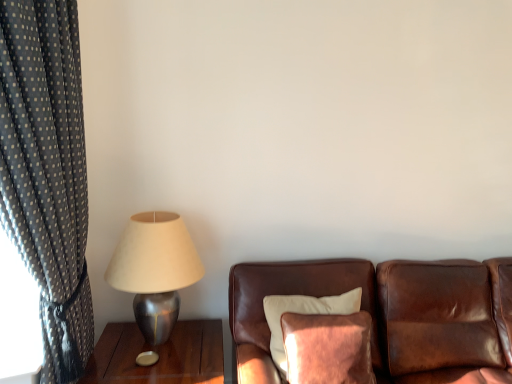
Question: From the image's perspective, is brown leather couch at center beneath dark gray polka dot fabric at left?

Choices:
 (A) no
 (B) yes

Answer: (B)

Question: Is brown leather couch at center completely or partially outside of dark gray polka dot fabric at left?

Choices:
 (A) no
 (B) yes

Answer: (B)

Question: Considering the relative positions of brown leather couch at center and dark gray polka dot fabric at left in the image provided, is brown leather couch at center behind dark gray polka dot fabric at left?

Choices:
 (A) no
 (B) yes

Answer: (B)

Question: Is dark gray polka dot fabric at left completely or partially inside brown leather couch at center?

Choices:
 (A) yes
 (B) no

Answer: (B)

Question: Is brown leather couch at center bigger than dark gray polka dot fabric at left?

Choices:
 (A) no
 (B) yes

Answer: (B)

Question: Could you tell me if brown leather couch at center is turned towards dark gray polka dot fabric at left?

Choices:
 (A) no
 (B) yes

Answer: (A)

Question: Can you confirm if velvet brown pillow at center is wider than metallic silver table at left?

Choices:
 (A) yes
 (B) no

Answer: (B)

Question: Is velvet brown pillow at center directly adjacent to metallic silver table at left?

Choices:
 (A) yes
 (B) no

Answer: (B)

Question: Is velvet brown pillow at center behind metallic silver table at left?

Choices:
 (A) no
 (B) yes

Answer: (A)

Question: From the image's perspective, is velvet brown pillow at center on metallic silver table at left?

Choices:
 (A) no
 (B) yes

Answer: (B)

Question: Does velvet brown pillow at center have a greater height compared to metallic silver table at left?

Choices:
 (A) yes
 (B) no

Answer: (A)

Question: Is velvet brown pillow at center at the left side of metallic silver table at left?

Choices:
 (A) yes
 (B) no

Answer: (B)

Question: Does metallic silver table at left have a larger size compared to velvet brown pillow at center?

Choices:
 (A) yes
 (B) no

Answer: (A)